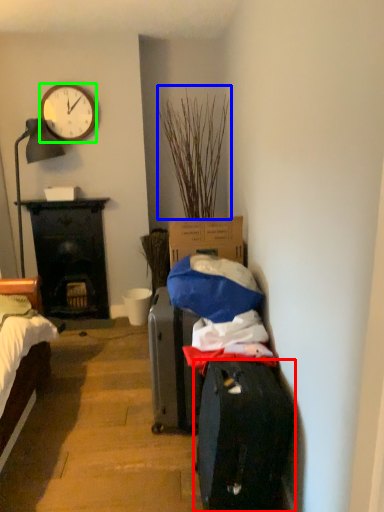
Question: Which object is the closest to the luggage and bags (highlighted by a red box)? Choose among these: plant (highlighted by a blue box) or clock (highlighted by a green box).

Choices:
 (A) plant
 (B) clock

Answer: (A)